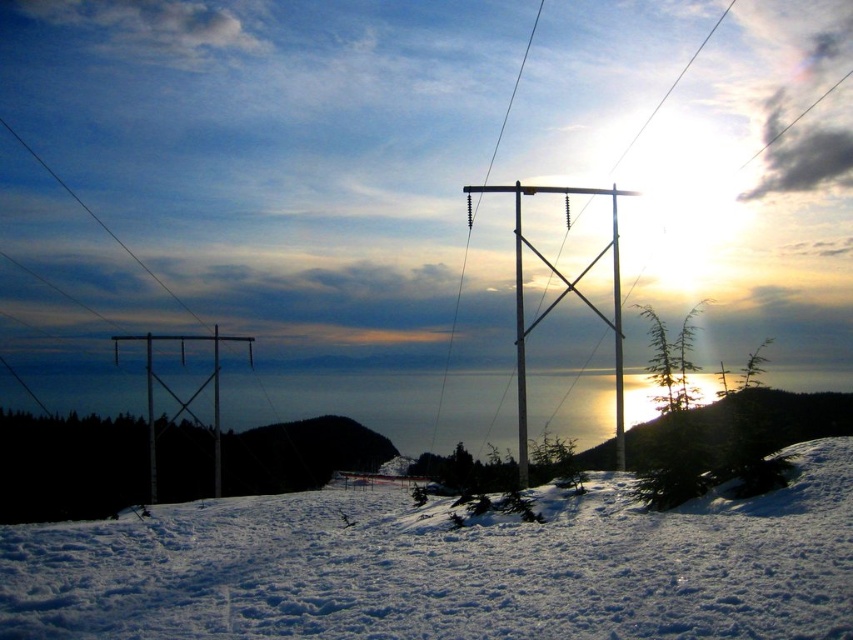
You are an observer standing in the winter landscape scene. You notice the white fluffy snow at center and the metallic silver pole at center. Which object appears smaller in the image?

The white fluffy snow at center appears smaller than the metallic silver pole at center.

You are a photographer wanting to capture the metallic silver telegraph pole at center and the white fluffy snow at center in your shot. Which object will appear larger in the photo?

The metallic silver telegraph pole at center will appear larger in the photo because it is bigger than the white fluffy snow at center.